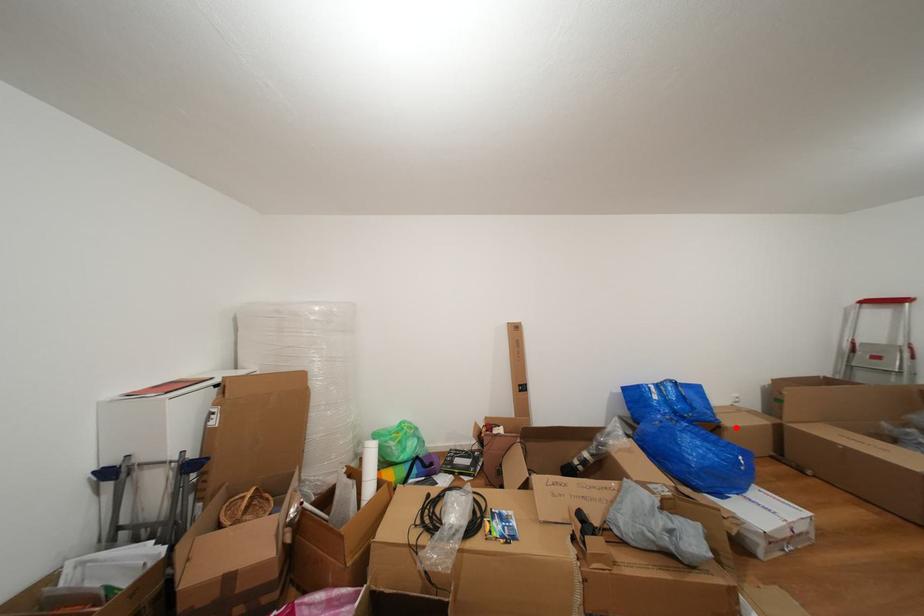
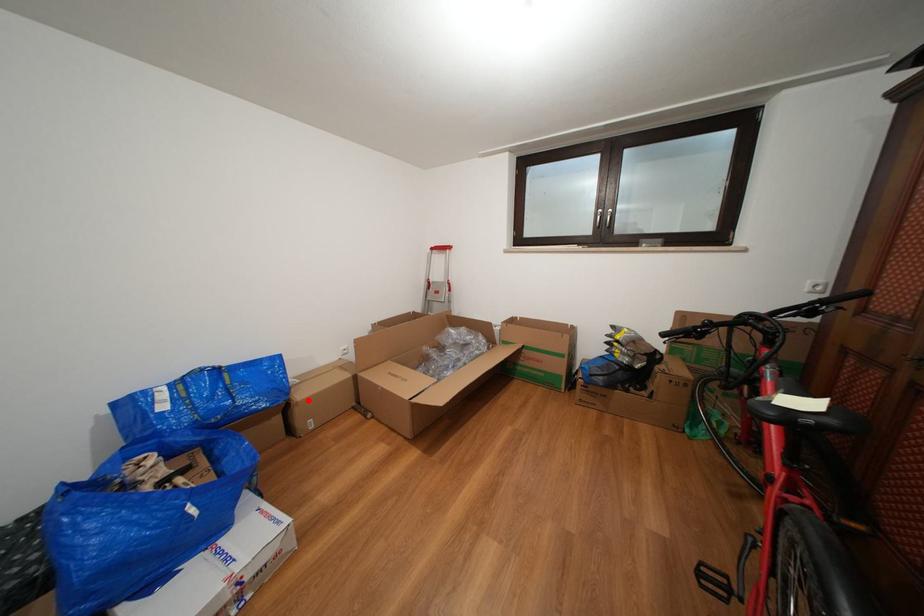
I am providing you with two images of the same scene from different viewpoints. A red point is marked on the first image and another point is marked on the second image. Is the red point in image1 aligned with the point shown in image2?

Yes